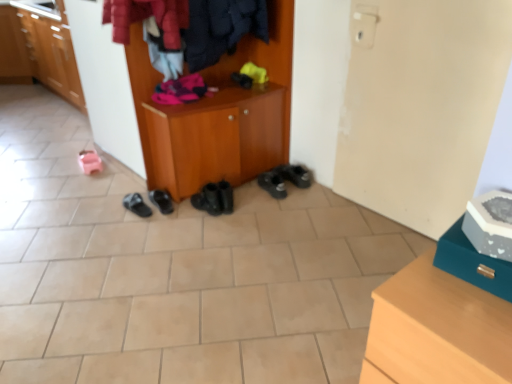
Question: Is matte wood cabinet at left, which is the 1th cabinetry from top to bottom, to the right of black rubber shoes at center, the second footwear in the right-to-left sequence, from the viewer's perspective?

Choices:
 (A) yes
 (B) no

Answer: (B)

Question: From the image's perspective, is matte wood cabinet at left, which is the 2th cabinetry in bottom-to-top order, under black rubber shoes at center, arranged as the 5th footwear when viewed from the left?

Choices:
 (A) no
 (B) yes

Answer: (A)

Question: Is matte wood cabinet at left, which is the 1th cabinetry from top to bottom, far away from black rubber shoes at center, arranged as the 5th footwear when viewed from the left?

Choices:
 (A) no
 (B) yes

Answer: (B)

Question: Is black rubber shoes at center, the second footwear in the right-to-left sequence, inside matte wood cabinet at left, which is the 2th cabinetry in bottom-to-top order?

Choices:
 (A) no
 (B) yes

Answer: (A)

Question: From a real-world perspective, is matte wood cabinet at left, which is the 2th cabinetry in bottom-to-top order, positioned under black rubber shoes at center, the second footwear in the right-to-left sequence, based on gravity?

Choices:
 (A) no
 (B) yes

Answer: (A)

Question: Based on their sizes in the image, would you say pink rubber sandals at lower left, which is the first footwear in left-to-right order, is bigger or smaller than teal leather shoe at lower right, which is the second shoe from top to bottom?

Choices:
 (A) small
 (B) big

Answer: (A)

Question: Is point (96, 157) closer or farther from the camera than point (493, 266)?

Choices:
 (A) farther
 (B) closer

Answer: (A)

Question: In terms of height, does pink rubber sandals at lower left, which is the first footwear in left-to-right order, look taller or shorter compared to teal leather shoe at lower right, the 1th shoe ordered from the bottom?

Choices:
 (A) short
 (B) tall

Answer: (A)

Question: Is pink rubber sandals at lower left, which is the first footwear in left-to-right order, situated inside teal leather shoe at lower right, the 1th shoe ordered from the bottom, or outside?

Choices:
 (A) inside
 (B) outside

Answer: (B)

Question: Is black rubber shoes at center, the 3th footwear positioned from the left, wider or thinner than matte wood cabinet at left, which is the 2th cabinetry in bottom-to-top order?

Choices:
 (A) wide
 (B) thin

Answer: (B)

Question: Considering the relative positions of black rubber shoes at center, the 4th footwear positioned from the right, and matte wood cabinet at left, the second cabinetry positioned from the right, in the image provided, is black rubber shoes at center, the 4th footwear positioned from the right, to the left or to the right of matte wood cabinet at left, the second cabinetry positioned from the right,?

Choices:
 (A) left
 (B) right

Answer: (B)

Question: Does point (161, 193) appear closer or farther from the camera than point (70, 62)?

Choices:
 (A) farther
 (B) closer

Answer: (B)

Question: In the image, is black rubber shoes at center, the 4th footwear positioned from the right, positioned in front of or behind matte wood cabinet at left, arranged as the first cabinetry when viewed from the left?

Choices:
 (A) front
 (B) behind

Answer: (A)

Question: In terms of width, does pink rubber sandals at lower left, marked as the 6th footwear in a right-to-left arrangement, look wider or thinner when compared to black rubber shoes at lower right, positioned as the 1th footwear in right-to-left order?

Choices:
 (A) thin
 (B) wide

Answer: (A)

Question: Considering the positions of pink rubber sandals at lower left, which is the first footwear in left-to-right order, and black rubber shoes at lower right, which is the sixth footwear in left-to-right order, in the image, is pink rubber sandals at lower left, which is the first footwear in left-to-right order, taller or shorter than black rubber shoes at lower right, which is the sixth footwear in left-to-right order,?

Choices:
 (A) short
 (B) tall

Answer: (A)